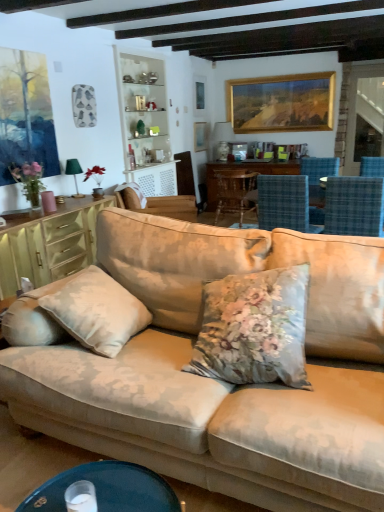
The image size is (384, 512). In order to click on vacant space situated above blue glossy tray at lower center (from a real-world perspective) in this screenshot , I will do `click(100, 489)`.